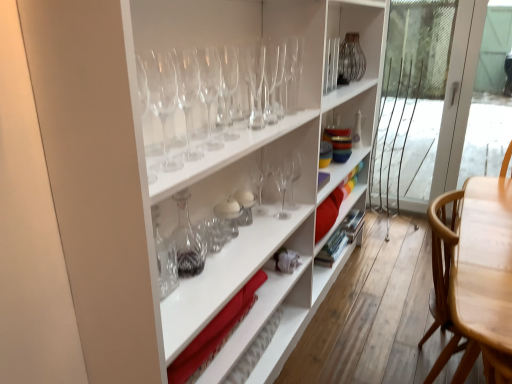
Find the location of a particular element. The height and width of the screenshot is (384, 512). transparent glass wine glasses at upper center, which is the 9th wine glass from back to front is located at coordinates (187, 92).

What is the approximate width of transparent plastic screen door at right?

transparent plastic screen door at right is 3.33 inches wide.

Based on the photo, how much space does clear glass wine glass at upper center, which is counted as the 4th wine glass, starting from the back, occupy horizontally?

The width of clear glass wine glass at upper center, which is counted as the 4th wine glass, starting from the back, is 2.45 inches.

You are a GUI agent. You are given a task and a screenshot of the screen. Output one action in this format:
    pyautogui.click(x=<x>, y=<y>)
    Task: Click on the transparent glass wine glass at upper center, arranged as the 4th wine glass when viewed from the front
    
    Given the screenshot: What is the action you would take?
    pyautogui.click(x=228, y=87)

This screenshot has height=384, width=512. Identify the location of clear glass decanter at center. (187, 240).

From a real-world perspective, is transparent glass wine glass at center, arranged as the 1th wine glass when viewed from the back, located beneath light brown wood chair at right?

No.

Is transparent glass wine glass at center, the tenth wine glass in the front-to-back sequence, taller or shorter than light brown wood chair at right?

Clearly, transparent glass wine glass at center, the tenth wine glass in the front-to-back sequence, is shorter compared to light brown wood chair at right.

The width and height of the screenshot is (512, 384). Find the location of `wine glass that is the 3rd one above the light brown wood chair at right (from a real-world perspective)`. wine glass that is the 3rd one above the light brown wood chair at right (from a real-world perspective) is located at coordinates (259, 181).

Does transparent glass wine glass at center, arranged as the 1th wine glass when viewed from the back, lie in front of light brown wood chair at right?

No, transparent glass wine glass at center, arranged as the 1th wine glass when viewed from the back, is further to the viewer.

Is transparent glass wine glass at center, which is the fifth wine glass from front to back, aimed at transparent glass wine glasses at upper center, acting as the 2th wine glass starting from the front?

No, transparent glass wine glass at center, which is the fifth wine glass from front to back, does not turn towards transparent glass wine glasses at upper center, acting as the 2th wine glass starting from the front.

From the image's perspective, which object appears higher, transparent glass wine glass at center, which is the fifth wine glass from front to back, or transparent glass wine glasses at upper center, which is the 9th wine glass from back to front?

transparent glass wine glass at center, which is the fifth wine glass from front to back, appears higher in the image.

From a real-world perspective, is transparent glass wine glass at center, which is the fifth wine glass from front to back, under transparent glass wine glasses at upper center, acting as the 2th wine glass starting from the front?

Yes, from a real-world perspective, transparent glass wine glass at center, which is the fifth wine glass from front to back, is beneath transparent glass wine glasses at upper center, acting as the 2th wine glass starting from the front.

Are transparent glass wine glass at center, arranged as the sixth wine glass when viewed from the back, and transparent glass wine glasses at upper center, which is the 9th wine glass from back to front, making contact?

No, transparent glass wine glass at center, arranged as the sixth wine glass when viewed from the back, is not beside transparent glass wine glasses at upper center, which is the 9th wine glass from back to front.

In terms of width, does light brown wood chair at right look wider or thinner when compared to transparent glass wine glasses at upper center, acting as the 2th wine glass starting from the front?

Considering their sizes, light brown wood chair at right looks broader than transparent glass wine glasses at upper center, acting as the 2th wine glass starting from the front.

Is point (467, 281) less distant than point (181, 63)?

No, it is behind (181, 63).

Is the depth of light brown wood chair at right less than that of transparent glass wine glasses at upper center, which is the 9th wine glass from back to front?

No, it is not.

Do you think light brown wood chair at right is within transparent glass wine glass at upper center, acting as the 7th wine glass starting from the back, or outside of it?

The correct answer is: outside.

Could you measure the distance between light brown wood chair at right and transparent glass wine glass at upper center, acting as the 7th wine glass starting from the back?

light brown wood chair at right is 94.09 centimeters from transparent glass wine glass at upper center, acting as the 7th wine glass starting from the back.

How different are the orientations of light brown wood chair at right and transparent glass wine glass at upper center, arranged as the 4th wine glass when viewed from the front, in degrees?

2.04 degrees.

Which is more to the left, light brown wood chair at right or transparent glass wine glass at upper center, acting as the 7th wine glass starting from the back?

transparent glass wine glass at upper center, acting as the 7th wine glass starting from the back, is more to the left.

From the image's perspective, between clear glass wine glass at center, which is the 3th wine glass from front to back, and transparent plastic screen door at right, who is located below?

clear glass wine glass at center, which is the 3th wine glass from front to back, appears lower in the image.

Is transparent plastic screen door at right inside clear glass wine glass at center, which is the 3th wine glass from front to back?

No, transparent plastic screen door at right is not a part of clear glass wine glass at center, which is the 3th wine glass from front to back.

From a real-world perspective, is clear glass wine glass at center, which is the 3th wine glass from front to back, positioned under transparent plastic screen door at right based on gravity?

No.

Which of these two, clear glass wine glass at center, which is the 3th wine glass from front to back, or transparent plastic screen door at right, is thinner?

transparent plastic screen door at right.

Is transparent glass wine glass at center, which is the fifth wine glass from front to back, bigger or smaller than transparent glass wine glass at center, arranged as the 1th wine glass when viewed from the back?

In the image, transparent glass wine glass at center, which is the fifth wine glass from front to back, appears to be smaller than transparent glass wine glass at center, arranged as the 1th wine glass when viewed from the back.

Is there a large distance between transparent glass wine glass at center, arranged as the sixth wine glass when viewed from the back, and transparent glass wine glass at center, arranged as the 1th wine glass when viewed from the back?

No, transparent glass wine glass at center, arranged as the sixth wine glass when viewed from the back, is not far from transparent glass wine glass at center, arranged as the 1th wine glass when viewed from the back.

Between transparent glass wine glass at center, which is the fifth wine glass from front to back, and transparent glass wine glass at center, the tenth wine glass in the front-to-back sequence, which one has smaller width?

With smaller width is transparent glass wine glass at center, which is the fifth wine glass from front to back.

Is point (248, 123) closer or farther from the camera than point (262, 176)?

Point (248, 123).

Consider the image. Considering the relative positions of clear glass decanter at center and transparent glass wine glass at center, the tenth wine glass in the front-to-back sequence, in the image provided, is clear glass decanter at center to the left or to the right of transparent glass wine glass at center, the tenth wine glass in the front-to-back sequence,?

Based on their positions, clear glass decanter at center is located to the left of transparent glass wine glass at center, the tenth wine glass in the front-to-back sequence.

Is clear glass decanter at center shorter than transparent glass wine glass at center, the tenth wine glass in the front-to-back sequence?

In fact, clear glass decanter at center may be taller than transparent glass wine glass at center, the tenth wine glass in the front-to-back sequence.

How different are the orientations of clear glass decanter at center and transparent glass wine glass at center, arranged as the 1th wine glass when viewed from the back, in degrees?

The angular difference between clear glass decanter at center and transparent glass wine glass at center, arranged as the 1th wine glass when viewed from the back, is 5.6 degrees.

Which of these two, clear glass decanter at center or transparent glass wine glass at center, arranged as the 1th wine glass when viewed from the back, is thinner?

transparent glass wine glass at center, arranged as the 1th wine glass when viewed from the back.

Identify the location of chair located below the transparent glass wine glass at center, arranged as the 1th wine glass when viewed from the back (from the image's perspective). This screenshot has width=512, height=384. (481, 269).

From the transparent glass wine glasses at upper center, acting as the 2th wine glass starting from the front, count 3rd wine glass to the right and point to it. Please provide its 2D coordinates.

[(255, 81)]

Estimate the real-world distances between objects in this image. Which object is closer to transparent glass wine glass at upper center, acting as the 7th wine glass starting from the back, transparent glass wine glass at center, the ninth wine glass when ordered from front to back, or clear glass wine glass at center, which is the 3th wine glass from front to back?

clear glass wine glass at center, which is the 3th wine glass from front to back, is closer to transparent glass wine glass at upper center, acting as the 7th wine glass starting from the back.

In the scene shown: When comparing their distances from transparent glass wine glass at upper center, arranged as the 10th wine glass when viewed from the back, does transparent glass wine glass at upper center, which is the fifth wine glass in back-to-front order, or transparent glass wine glass at center, which is the fifth wine glass from front to back, seem further?

transparent glass wine glass at upper center, which is the fifth wine glass in back-to-front order, lies further to transparent glass wine glass at upper center, arranged as the 10th wine glass when viewed from the back, than the other object.

Estimate the real-world distances between objects in this image. Which object is further from clear glass wine glass at upper center, which is counted as the 4th wine glass, starting from the back, transparent glass wine glass at upper center, arranged as the 4th wine glass when viewed from the front, or transparent glass wine glass at center, arranged as the 1th wine glass when viewed from the back?

transparent glass wine glass at center, arranged as the 1th wine glass when viewed from the back, is positioned further to the anchor clear glass wine glass at upper center, which is counted as the 4th wine glass, starting from the back.

When comparing their distances from transparent glass wine glass at center, the tenth wine glass in the front-to-back sequence, does transparent glass wine glass at upper center, arranged as the 10th wine glass when viewed from the back, or clear glass wine glass at center, which is the 3th wine glass from front to back, seem closer?

clear glass wine glass at center, which is the 3th wine glass from front to back.

Based on their spatial positions, is transparent plastic screen door at right or transparent glass wine glass at center, which appears as the 2th wine glass when viewed from the back, further from transparent glass wine glass at center, arranged as the 1th wine glass when viewed from the back?

transparent plastic screen door at right.

Based on their spatial positions, is transparent plastic screen door at right or clear glass decanter at center closer to transparent glass wine glass at center, acting as the third wine glass starting from the back?

clear glass decanter at center lies closer to transparent glass wine glass at center, acting as the third wine glass starting from the back, than the other object.

Looking at the image, which one is located closer to transparent glass wine glass at center, arranged as the sixth wine glass when viewed from the back, transparent glass wine glass at upper center, the sixth wine glass when ordered from front to back, or transparent plastic screen door at right?

The object closer to transparent glass wine glass at center, arranged as the sixth wine glass when viewed from the back, is transparent glass wine glass at upper center, the sixth wine glass when ordered from front to back.

Which object lies nearer to the anchor point transparent glass wine glass at upper center, which is the fifth wine glass in back-to-front order, light brown wood chair at right or transparent glass wine glass at upper center, arranged as the 4th wine glass when viewed from the front?

transparent glass wine glass at upper center, arranged as the 4th wine glass when viewed from the front, is closer to transparent glass wine glass at upper center, which is the fifth wine glass in back-to-front order.

Identify the location of glass vase positioned between clear glass wine glass at center, which is the 3th wine glass from front to back, and transparent glass wine glass at center, the ninth wine glass when ordered from front to back, from near to far. (187, 240).

At what (x,y) coordinates should I click in order to perform the action: click on glass vase between clear glass wine glass at center, which appears as the 8th wine glass when viewed from the back, and transparent glass wine glass at center, the tenth wine glass in the front-to-back sequence, from front to back. Please return your answer as a coordinate pair (x, y). The image size is (512, 384). Looking at the image, I should click on (187, 240).

The image size is (512, 384). Find the location of `chair positioned between clear glass decanter at center and transparent plastic screen door at right from near to far`. chair positioned between clear glass decanter at center and transparent plastic screen door at right from near to far is located at coordinates (x=481, y=269).

Locate an element on the screen. chair positioned between transparent glass wine glass at upper center, arranged as the 4th wine glass when viewed from the front, and transparent plastic screen door at right from near to far is located at coordinates (481, 269).